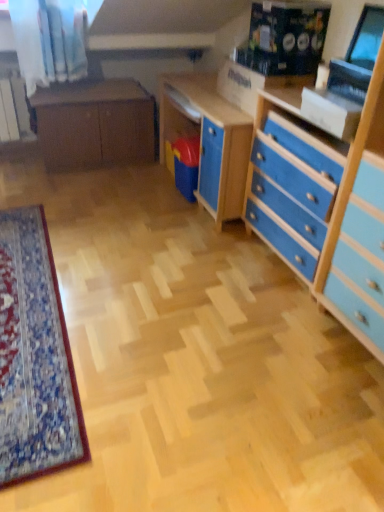
Question: From a real-world perspective, is matte brown cabinet at center located higher than matte black monitor at upper right?

Choices:
 (A) no
 (B) yes

Answer: (A)

Question: Is matte brown cabinet at center oriented towards matte black monitor at upper right?

Choices:
 (A) no
 (B) yes

Answer: (A)

Question: Is matte brown cabinet at center at the left side of matte black monitor at upper right?

Choices:
 (A) no
 (B) yes

Answer: (B)

Question: Can you confirm if matte brown cabinet at center is shorter than matte black monitor at upper right?

Choices:
 (A) no
 (B) yes

Answer: (A)

Question: Is matte brown cabinet at center looking in the opposite direction of matte black monitor at upper right?

Choices:
 (A) yes
 (B) no

Answer: (B)

Question: Is point (x=119, y=123) closer or farther from the camera than point (x=367, y=8)?

Choices:
 (A) closer
 (B) farther

Answer: (B)

Question: From the image's perspective, is matte brown cabinet at center above or below matte black monitor at upper right?

Choices:
 (A) above
 (B) below

Answer: (A)

Question: From their relative heights in the image, would you say matte brown cabinet at center is taller or shorter than matte black monitor at upper right?

Choices:
 (A) short
 (B) tall

Answer: (B)

Question: Considering the positions of matte brown cabinet at center and matte black monitor at upper right in the image, is matte brown cabinet at center bigger or smaller than matte black monitor at upper right?

Choices:
 (A) big
 (B) small

Answer: (A)

Question: Visually, is blue painted wood chest of drawers at right positioned to the left or to the right of matte black monitor at upper right?

Choices:
 (A) right
 (B) left

Answer: (B)

Question: Considering their positions, is blue painted wood chest of drawers at right located in front of or behind matte black monitor at upper right?

Choices:
 (A) front
 (B) behind

Answer: (A)

Question: Considering the positions of point (367, 128) and point (360, 28), is point (367, 128) closer or farther from the camera than point (360, 28)?

Choices:
 (A) closer
 (B) farther

Answer: (A)

Question: From a real-world perspective, is blue painted wood chest of drawers at right above or below matte black monitor at upper right?

Choices:
 (A) below
 (B) above

Answer: (A)

Question: Is blue painted wood chest of drawers at right to the left or to the right of matte brown cabinet at center in the image?

Choices:
 (A) left
 (B) right

Answer: (B)

Question: Considering the positions of blue painted wood chest of drawers at right and matte brown cabinet at center in the image, is blue painted wood chest of drawers at right bigger or smaller than matte brown cabinet at center?

Choices:
 (A) big
 (B) small

Answer: (B)